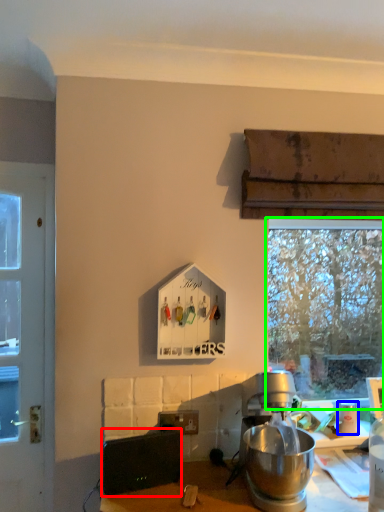
Question: Which object is positioned farthest from appliance (highlighted by a red box)? Select from coffee cup (highlighted by a blue box) and window (highlighted by a green box).

Choices:
 (A) coffee cup
 (B) window

Answer: (B)